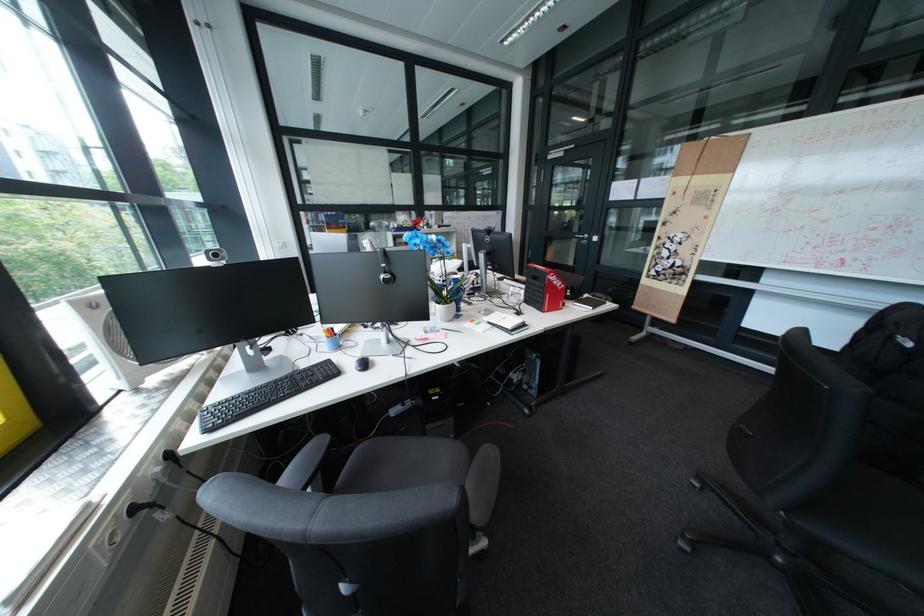
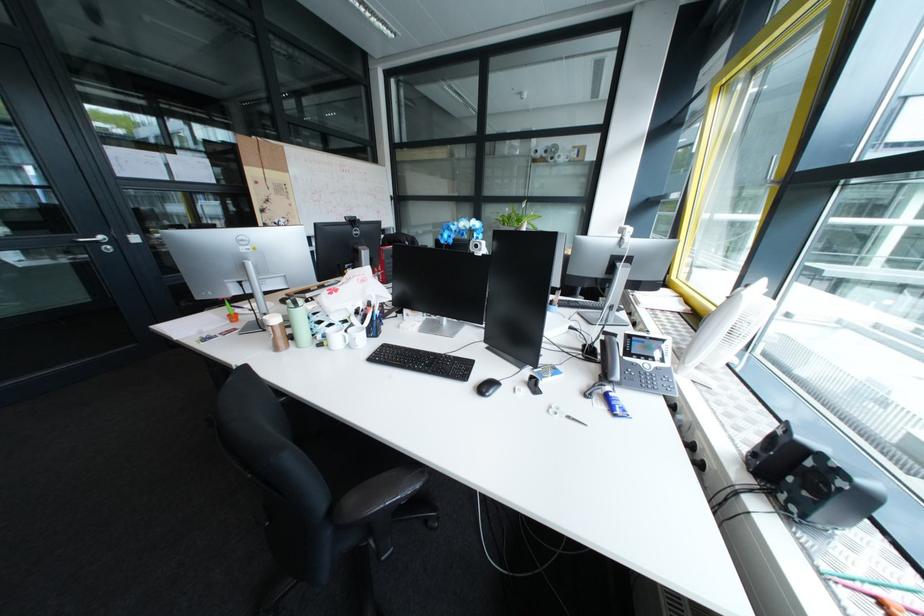
Question: I am providing you with two images of the same scene from different viewpoints. After the viewpoint changes to image2, which objects are now occluded?

Choices:
 (A) paper towel from dispenser
 (B) phone handset
 (C) brown shaker cup
 (D) grey chair sitting surface

Answer: (D)